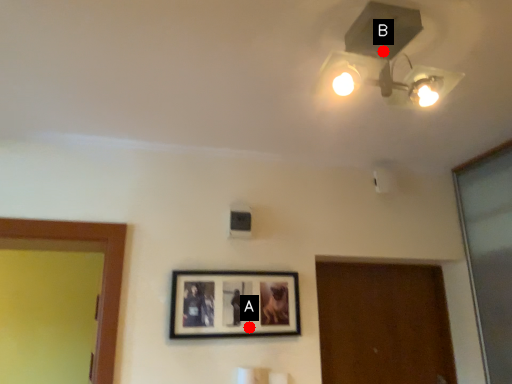
Question: Two points are circled on the image, labeled by A and B beside each circle. Among these points, which one is farthest from the camera?

Choices:
 (A) A is further
 (B) B is further

Answer: (A)